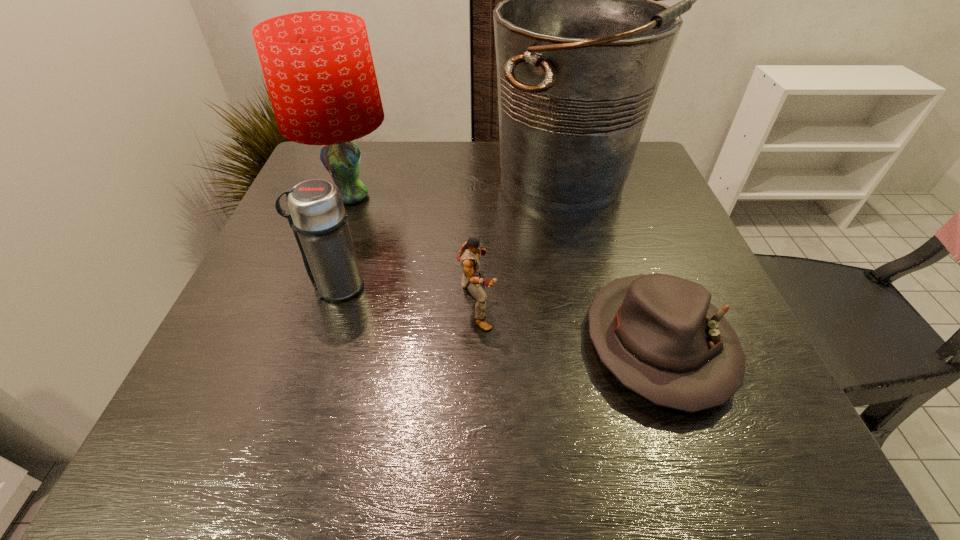
You are a GUI agent. You are given a task and a screenshot of the screen. Output one action in this format:
    pyautogui.click(x=<x>, y=<y>)
    Task: Click on the object positioned at the near right corner
    The height and width of the screenshot is (540, 960).
    Given the screenshot: What is the action you would take?
    pyautogui.click(x=659, y=335)

This screenshot has height=540, width=960. In the image, there is a desktop. Find the location of `blank space at the far edge`. blank space at the far edge is located at coordinates 392,147.

I want to click on vacant region at the near edge of the desktop, so click(x=441, y=420).

In the image, there is a desktop. Where is `vacant space at the left edge`? vacant space at the left edge is located at coordinates (249, 287).

This screenshot has width=960, height=540. In the image, there is a desktop. Find the location of `vacant region at the right edge`. vacant region at the right edge is located at coordinates (680, 229).

Image resolution: width=960 pixels, height=540 pixels. Find the location of `free region at the far left corner of the desktop`. free region at the far left corner of the desktop is located at coordinates (362, 158).

Identify the location of vacant space at the near left corner of the desktop. The width and height of the screenshot is (960, 540). (180, 464).

Image resolution: width=960 pixels, height=540 pixels. What are the coordinates of `vacant space at the far right corner of the desktop` in the screenshot? It's located at (658, 183).

Locate an element on the screen. This screenshot has width=960, height=540. blank region between the shortest object and the third tallest object is located at coordinates (497, 315).

The height and width of the screenshot is (540, 960). What are the coordinates of `free space between the puncher and the lampshade` in the screenshot? It's located at (414, 252).